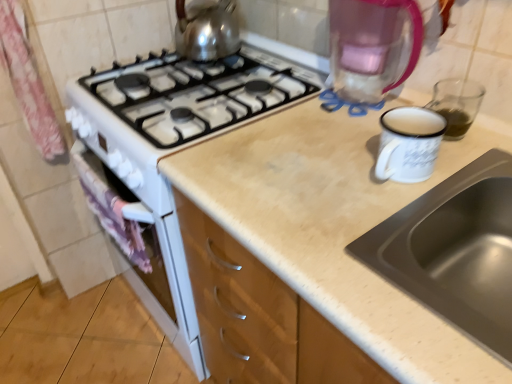
What do you see at coordinates (28, 81) in the screenshot? I see `pink fabric curtain at left` at bounding box center [28, 81].

What is the approximate width of pink fabric at left?

5.41 centimeters.

At what (x,y) coordinates should I click in order to perform the action: click on pink fabric at left. Please return your answer as a coordinate pair (x, y). The width and height of the screenshot is (512, 384). Looking at the image, I should click on (111, 212).

Describe the element at coordinates (371, 46) in the screenshot. This screenshot has height=384, width=512. I see `transparent plastic coffeepot at upper right` at that location.

The width and height of the screenshot is (512, 384). In order to click on stainless steel sink at upper right in this screenshot , I will do `click(454, 250)`.

Considering the positions of objects pink fabric at left and pink fabric curtain at left in the image provided, who is behind, pink fabric at left or pink fabric curtain at left?

pink fabric at left is further from the camera.

Considering the relative sizes of pink fabric at left and pink fabric curtain at left in the image provided, is pink fabric at left thinner than pink fabric curtain at left?

Yes.

In the scene shown: Who is shorter, pink fabric at left or pink fabric curtain at left?

→ With less height is pink fabric at left.

Is stainless steel sink at upper right turned away from green liquid at right?

No.

Does stainless steel sink at upper right have a lesser width compared to green liquid at right?

Incorrect, the width of stainless steel sink at upper right is not less than that of green liquid at right.

Is stainless steel sink at upper right far from green liquid at right?

No, there isn't a large distance between stainless steel sink at upper right and green liquid at right.

Between point (411, 286) and point (464, 130), which one is positioned in front?

Positioned in front is point (411, 286).

From a real-world perspective, which is physically above, pink fabric at left or green liquid at right?

green liquid at right, from a real-world perspective.

Based on the photo, is pink fabric at left positioned beyond the bounds of green liquid at right?

Yes, pink fabric at left is outside of green liquid at right.

Consider the image. From the image's perspective, is pink fabric at left located beneath green liquid at right?

Yes, from the image's perspective, pink fabric at left is beneath green liquid at right.

Which of these two, pink fabric at left or green liquid at right, is thinner?

pink fabric at left.

How different are the orientations of pink fabric curtain at left and transparent plastic coffeepot at upper right in degrees?

They differ by 88.3 degrees in their facing directions.

Looking at the image, does pink fabric curtain at left seem bigger or smaller compared to transparent plastic coffeepot at upper right?

Clearly, pink fabric curtain at left is smaller in size than transparent plastic coffeepot at upper right.

In the image, is pink fabric curtain at left positioned in front of or behind transparent plastic coffeepot at upper right?

In the image, pink fabric curtain at left appears behind transparent plastic coffeepot at upper right.

How much distance is there between stainless steel sink at upper right and shiny metallic kettle at upper center?

They are 34.49 inches apart.

Which object is more forward, stainless steel sink at upper right or shiny metallic kettle at upper center?

stainless steel sink at upper right is in front.

Consider the image. From a real-world perspective, who is located lower, stainless steel sink at upper right or shiny metallic kettle at upper center?

From a 3D spatial view, stainless steel sink at upper right is below.

Who is smaller, stainless steel sink at upper right or shiny metallic kettle at upper center?

shiny metallic kettle at upper center.

From a real-world perspective, is stainless steel sink at upper right positioned above or below transparent plastic coffeepot at upper right?

From a real-world perspective, stainless steel sink at upper right is physically below transparent plastic coffeepot at upper right.

Is stainless steel sink at upper right located outside transparent plastic coffeepot at upper right?

Absolutely, stainless steel sink at upper right is external to transparent plastic coffeepot at upper right.

Measure the distance from stainless steel sink at upper right to transparent plastic coffeepot at upper right.

stainless steel sink at upper right and transparent plastic coffeepot at upper right are 15.62 inches apart from each other.

Could you tell me if stainless steel sink at upper right is turned towards transparent plastic coffeepot at upper right?

No, stainless steel sink at upper right is not aimed at transparent plastic coffeepot at upper right.

Are green liquid at right and stainless steel sink at upper right located far from each other?

Actually, green liquid at right and stainless steel sink at upper right are a little close together.

From the image's perspective, is green liquid at right located beneath stainless steel sink at upper right?

Incorrect, from the image's perspective, green liquid at right is higher than stainless steel sink at upper right.

From a real-world perspective, is green liquid at right on top of stainless steel sink at upper right?

Yes, from a real-world perspective, green liquid at right is above stainless steel sink at upper right.

Is point (466, 113) in front of point (365, 259)?

That is False.

What are the coordinates of `cloth on the right of the pink fabric curtain at left` in the screenshot? It's located at (111, 212).

This screenshot has width=512, height=384. Identify the location of beverage above the stainless steel sink at upper right (from the image's perspective). (455, 123).

In the scene shown: Which object lies further to the anchor point transparent plastic coffeepot at upper right, pink fabric at left or stainless steel sink at upper right?

pink fabric at left lies further to transparent plastic coffeepot at upper right than the other object.

Which object lies further to the anchor point stainless steel sink at upper right, transparent plastic coffeepot at upper right or shiny metallic kettle at upper center?

Among the two, shiny metallic kettle at upper center is located further to stainless steel sink at upper right.

Which object lies nearer to the anchor point shiny metallic kettle at upper center, green liquid at right or stainless steel sink at upper right?

The object closer to shiny metallic kettle at upper center is green liquid at right.

Considering their positions, is stainless steel sink at upper right positioned closer to shiny metallic kettle at upper center than pink fabric at left?

pink fabric at left is closer to shiny metallic kettle at upper center.

Which object lies further to the anchor point pink fabric at left, stainless steel sink at upper right or green liquid at right?

Based on the image, green liquid at right appears to be further to pink fabric at left.

In the scene shown: From the image, which object appears to be farther from transparent plastic coffeepot at upper right, green liquid at right or pink fabric at left?

Among the two, pink fabric at left is located further to transparent plastic coffeepot at upper right.

Considering their positions, is green liquid at right positioned further to stainless steel sink at upper right than shiny metallic kettle at upper center?

shiny metallic kettle at upper center lies further to stainless steel sink at upper right than the other object.

From the image, which object appears to be farther from stainless steel sink at upper right, pink fabric curtain at left or shiny metallic kettle at upper center?

Based on the image, pink fabric curtain at left appears to be further to stainless steel sink at upper right.

Where is `coffeepot between shiny metallic kettle at upper center and green liquid at right from left to right`? Image resolution: width=512 pixels, height=384 pixels. coffeepot between shiny metallic kettle at upper center and green liquid at right from left to right is located at coordinates (371, 46).

Where is `kitchen appliance located between pink fabric at left and green liquid at right in the left-right direction`? Image resolution: width=512 pixels, height=384 pixels. kitchen appliance located between pink fabric at left and green liquid at right in the left-right direction is located at coordinates (207, 31).

Identify the location of cloth between pink fabric curtain at left and stainless steel sink at upper right from left to right. This screenshot has width=512, height=384. (111, 212).

You are a GUI agent. You are given a task and a screenshot of the screen. Output one action in this format:
    pyautogui.click(x=<x>, y=<y>)
    Task: Click on the coffeepot between stainless steel sink at upper right and shiny metallic kettle at upper center from front to back
    
    Given the screenshot: What is the action you would take?
    pyautogui.click(x=371, y=46)